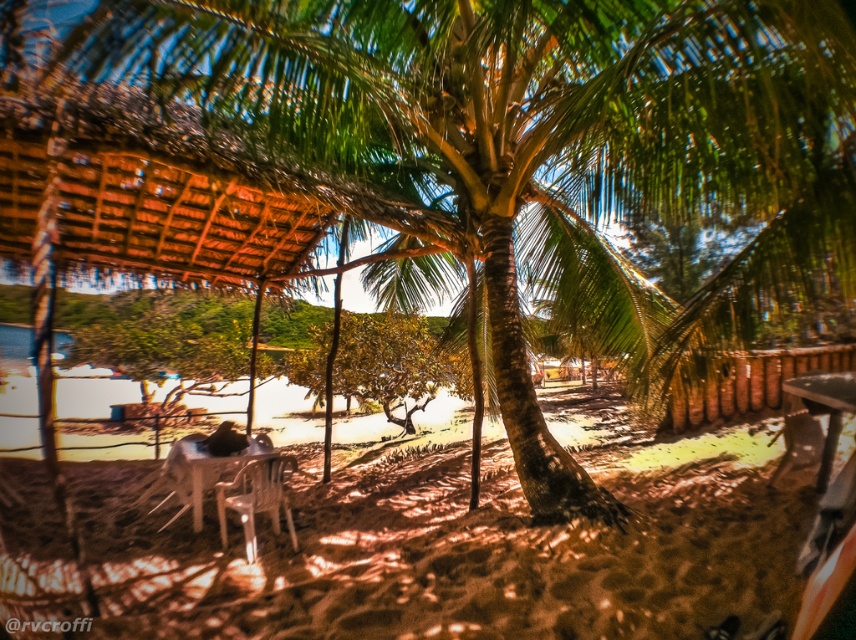
You are a beachgoer who wants to sit comfortably in the shade. You see the translucent plastic chair at center and the metallic silver table at lower right. Which object is shorter and thus might provide better shade coverage from the palm tree?

The translucent plastic chair at center is shorter than the metallic silver table at lower right, so it might provide better shade coverage from the palm tree since it is lower to the ground.

From the picture: You are a photographer setting up equipment on the beach. You have a camera that can only focus on objects wider than 1 meter. You see the thatched brown roof at upper left and the white plastic chair at lower left. Which object should you choose to ensure your camera can focus on it?

The thatched brown roof at upper left has a larger width than the white plastic chair at lower left, so you should choose the thatched brown roof at upper left to ensure your camera can focus on it since it meets the minimum width requirement.